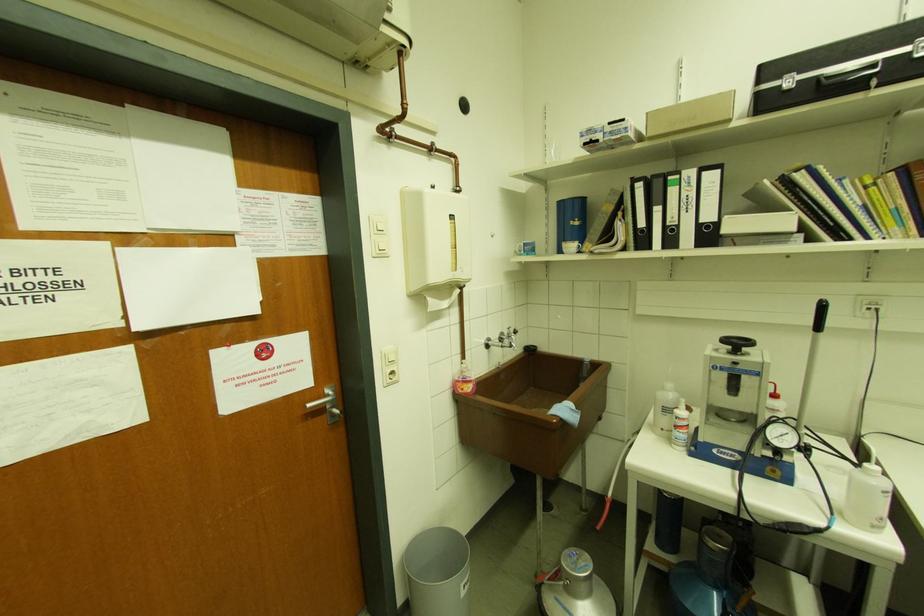
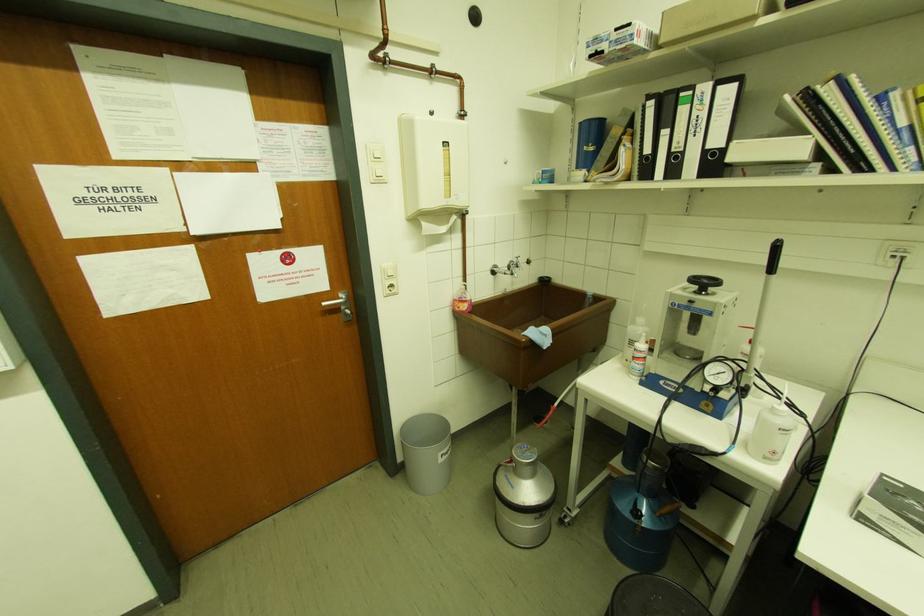
Locate, in the second image, the point that corresponds to (312,407) in the first image.

(326, 305)